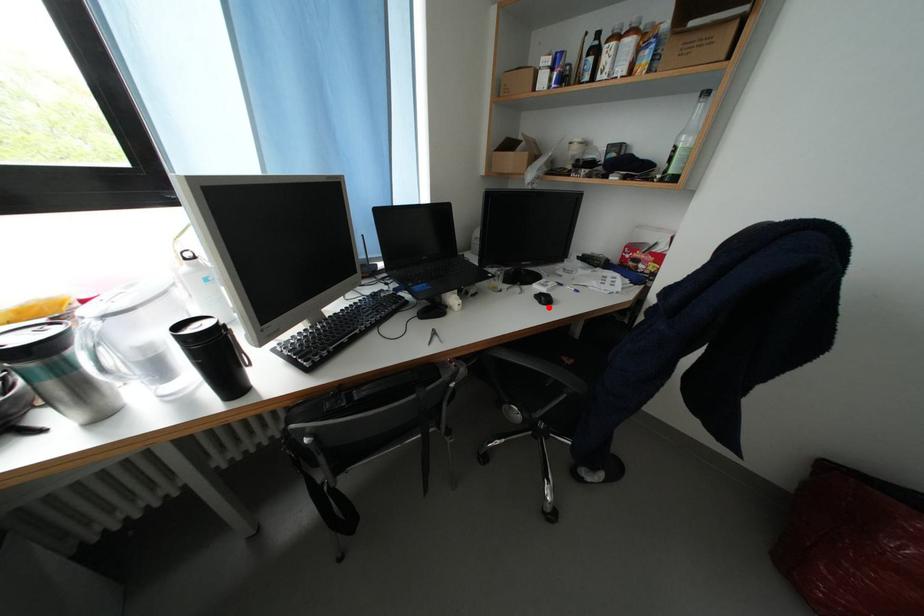
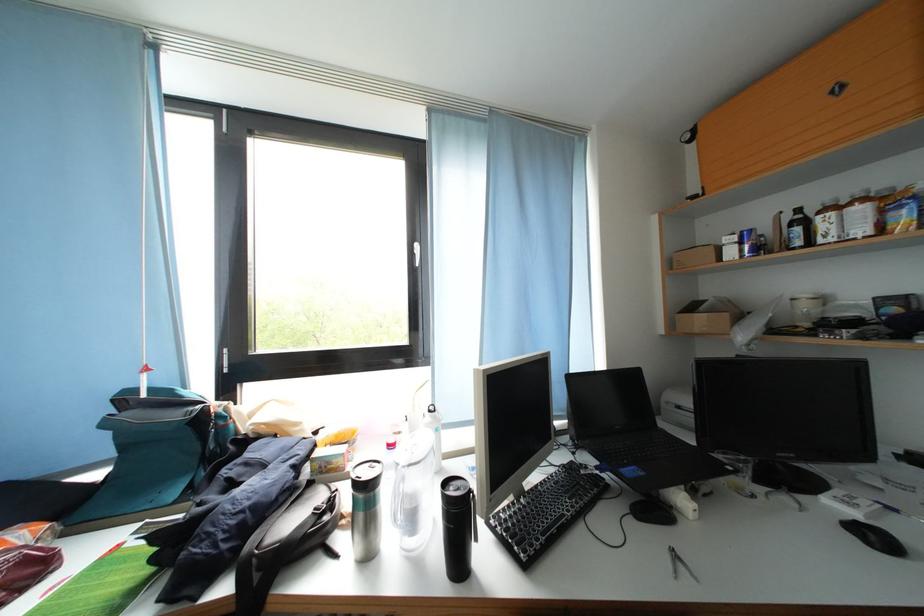
Question: I am providing you with two images of the same scene from different viewpoints. In image1, a red point is highlighted. Considering the same 3D point in image2, which of the following is correct?

Choices:
 (A) It is closer
 (B) It is farther

Answer: (A)